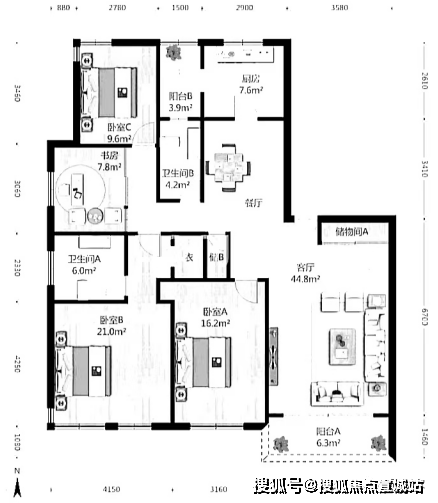
What are the coordinates of `stove` in the screenshot? It's located at (225, 52).